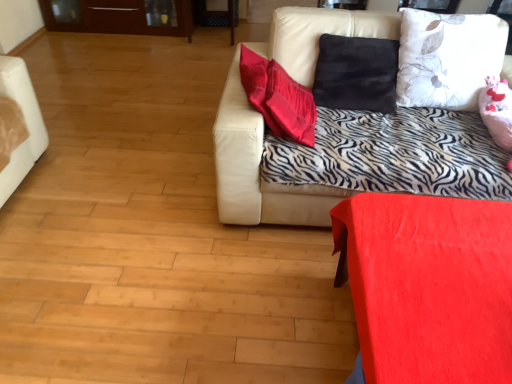
Question: Is leather couch at upper right located within white floral fabric pillow at upper right?

Choices:
 (A) no
 (B) yes

Answer: (A)

Question: Considering the relative positions of white floral fabric pillow at upper right and leather couch at upper right in the image provided, is white floral fabric pillow at upper right to the right of leather couch at upper right from the viewer's perspective?

Choices:
 (A) no
 (B) yes

Answer: (B)

Question: Is white floral fabric pillow at upper right at the left side of leather couch at upper right?

Choices:
 (A) yes
 (B) no

Answer: (B)

Question: Can you confirm if white floral fabric pillow at upper right is shorter than leather couch at upper right?

Choices:
 (A) yes
 (B) no

Answer: (A)

Question: Does white floral fabric pillow at upper right have a greater width compared to leather couch at upper right?

Choices:
 (A) no
 (B) yes

Answer: (A)

Question: Is matte red table at lower right spatially inside white floral fabric pillow at upper right, or outside of it?

Choices:
 (A) outside
 (B) inside

Answer: (A)

Question: Does point (499, 261) appear closer or farther from the camera than point (483, 51)?

Choices:
 (A) closer
 (B) farther

Answer: (A)

Question: From the image's perspective, is matte red table at lower right positioned above or below white floral fabric pillow at upper right?

Choices:
 (A) above
 (B) below

Answer: (B)

Question: Would you say matte red table at lower right is to the left or to the right of white floral fabric pillow at upper right in the picture?

Choices:
 (A) left
 (B) right

Answer: (A)

Question: Is white floral fabric pillow at upper right wider or thinner than leather couch at upper right?

Choices:
 (A) thin
 (B) wide

Answer: (A)

Question: From a real-world perspective, relative to leather couch at upper right, is white floral fabric pillow at upper right vertically above or below?

Choices:
 (A) below
 (B) above

Answer: (B)

Question: Considering the relative positions of white floral fabric pillow at upper right and leather couch at upper right in the image provided, is white floral fabric pillow at upper right to the left or to the right of leather couch at upper right?

Choices:
 (A) left
 (B) right

Answer: (B)

Question: Is point (445, 48) positioned closer to the camera than point (260, 137)?

Choices:
 (A) farther
 (B) closer

Answer: (A)

Question: Does point (297, 223) appear closer or farther from the camera than point (433, 43)?

Choices:
 (A) farther
 (B) closer

Answer: (A)

Question: From a real-world perspective, is leather couch at upper right positioned above or below white floral fabric pillow at upper right?

Choices:
 (A) below
 (B) above

Answer: (A)